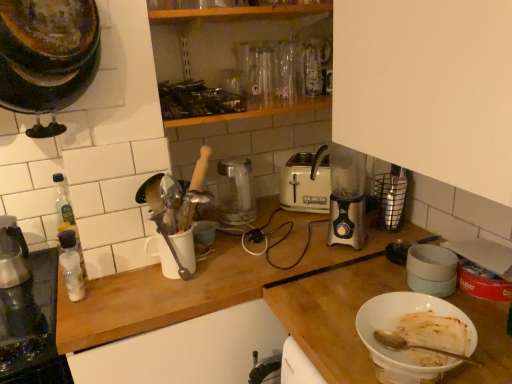
Locate an element on the screen. The width and height of the screenshot is (512, 384). vacant area that lies in front of white plastic bottle at left, the 2th bottle viewed from the front is located at coordinates (79, 304).